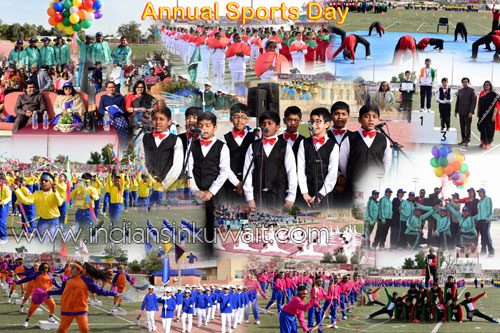
Image resolution: width=500 pixels, height=333 pixels. Identify the location of blue mat. (453, 41).